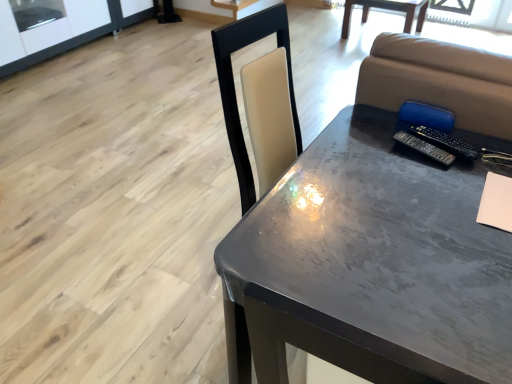
I want to click on blank space to the left of metallic gray table at center, arranged as the first table when viewed from the right, so click(x=325, y=38).